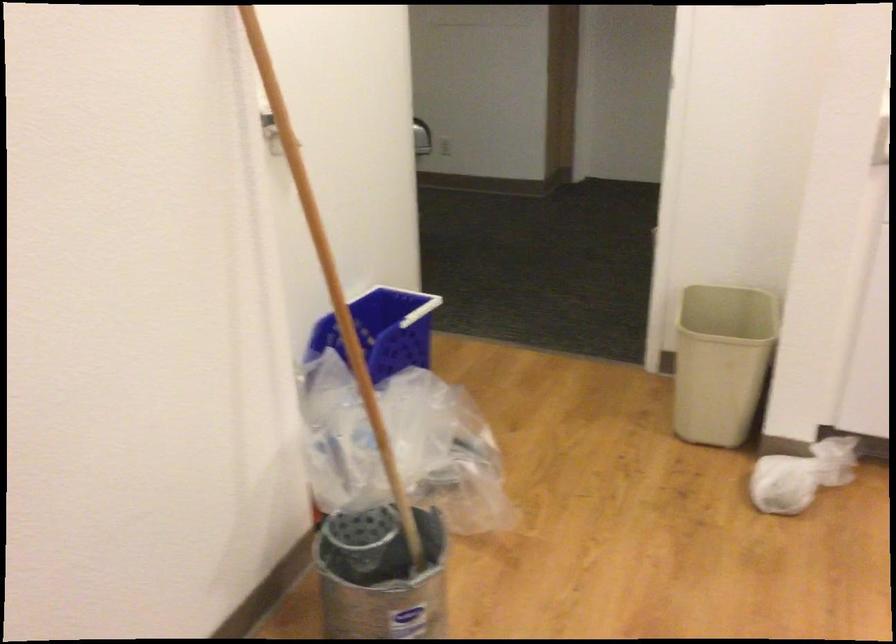
What do you see at coordinates (330, 275) in the screenshot?
I see `the mop handle` at bounding box center [330, 275].